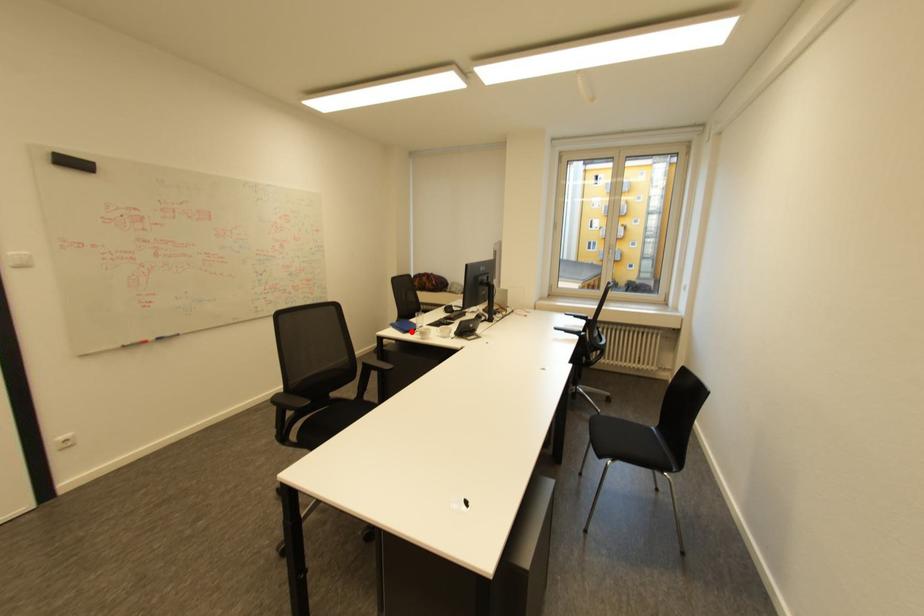
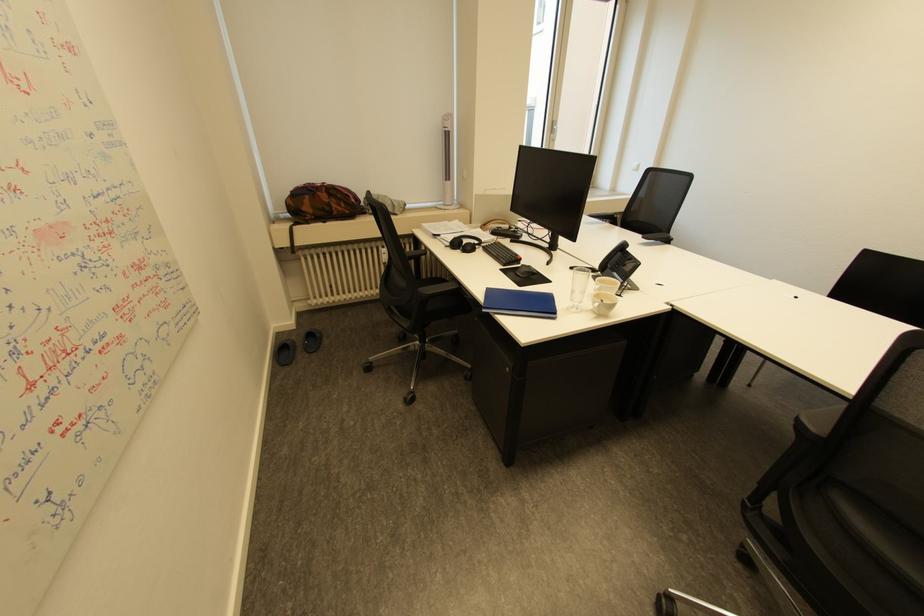
The point at the highlighted location is marked in the first image. Where is the corresponding point in the second image?

(562, 314)